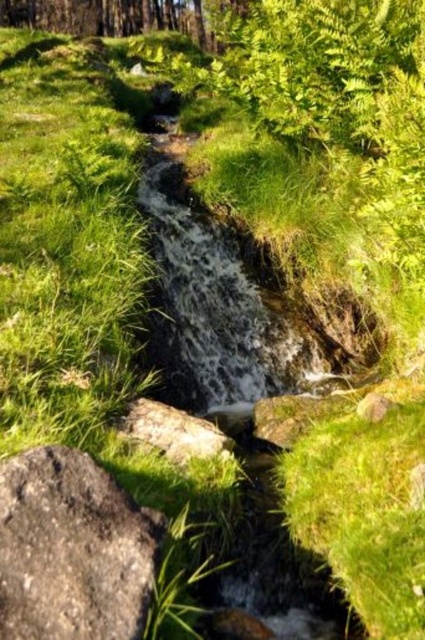
Question: Can you confirm if gray rough rock at lower left is positioned below gray rough rock at center?

Choices:
 (A) no
 (B) yes

Answer: (B)

Question: Which point appears farthest from the camera in this image?

Choices:
 (A) (139, 422)
 (B) (88, 600)

Answer: (A)

Question: Considering the relative positions of gray rough rock at lower left and gray rough rock at center in the image provided, where is gray rough rock at lower left located with respect to gray rough rock at center?

Choices:
 (A) below
 (B) above

Answer: (A)

Question: Which point is closer to the camera?

Choices:
 (A) (39, 579)
 (B) (184, 428)

Answer: (A)

Question: Does gray rough rock at lower left have a larger size compared to gray rough rock at center?

Choices:
 (A) yes
 (B) no

Answer: (A)